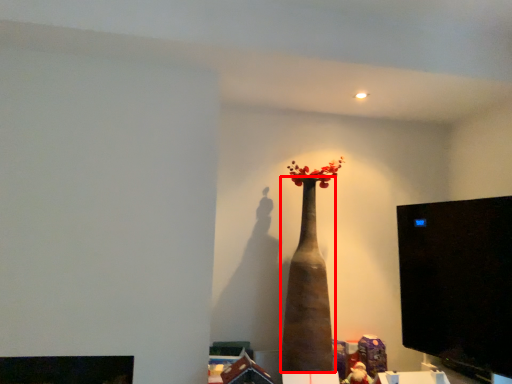
Question: Where is vase (annotated by the red box) located in relation to computer monitor in the image?

Choices:
 (A) right
 (B) left

Answer: (B)